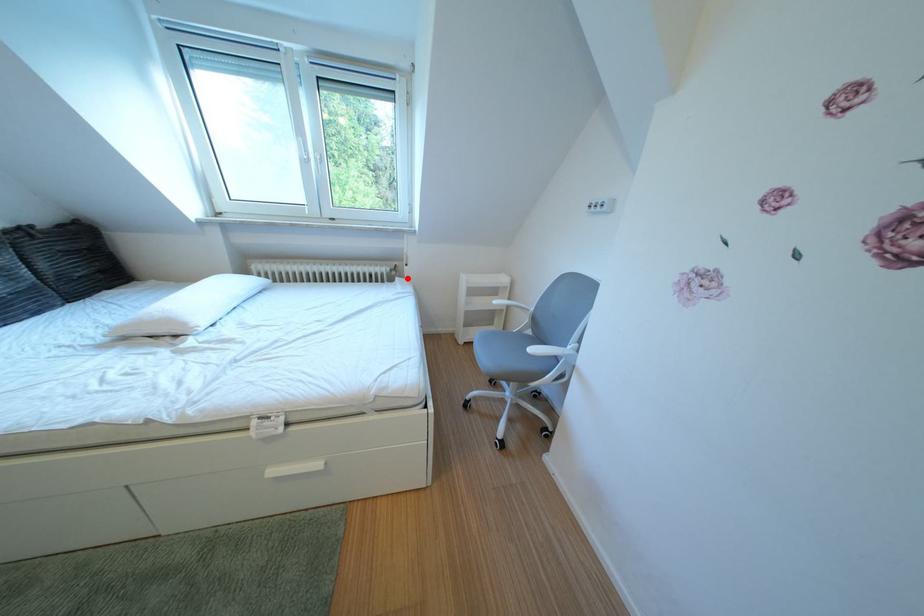
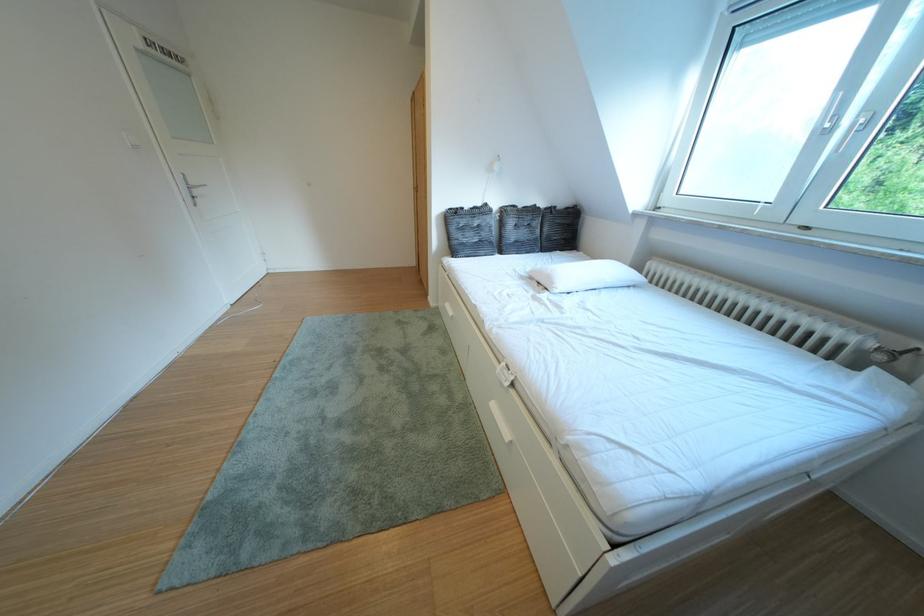
Question: I am providing you with two images of the same scene from different viewpoints. In image1, a red point is highlighted. Considering the same 3D point in image2, which of the following is correct?

Choices:
 (A) It is closer
 (B) It is farther

Answer: (B)